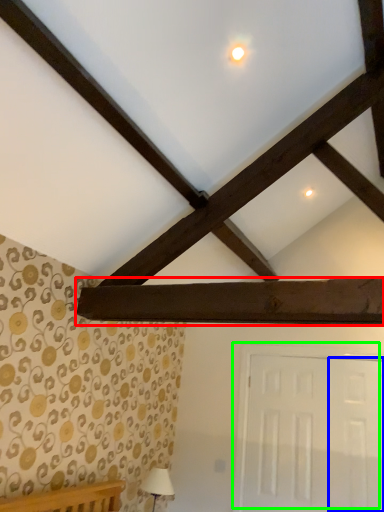
Question: Considering the real-world distances, which object is closest to plank (highlighted by a red box)? door (highlighted by a blue box) or door (highlighted by a green box).

Choices:
 (A) door
 (B) door

Answer: (A)